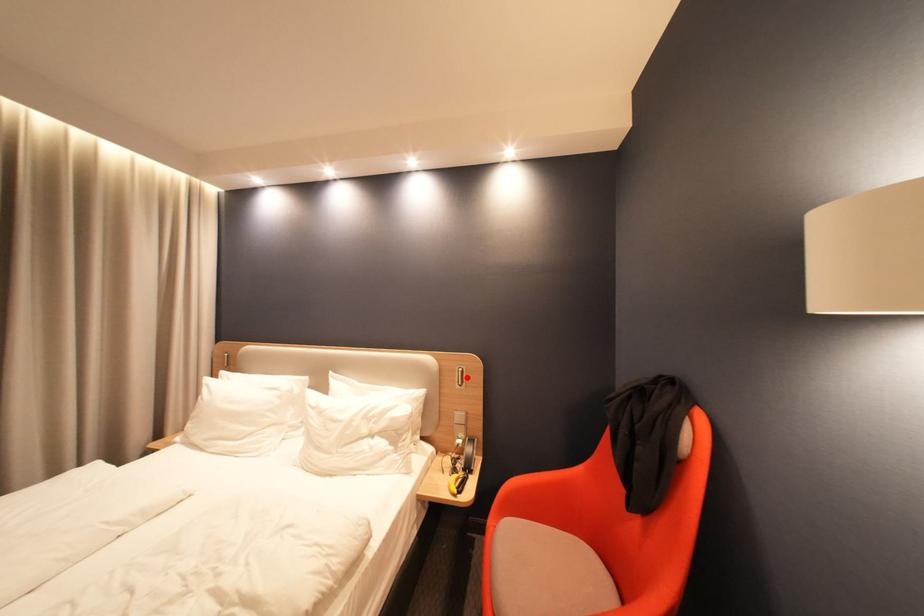
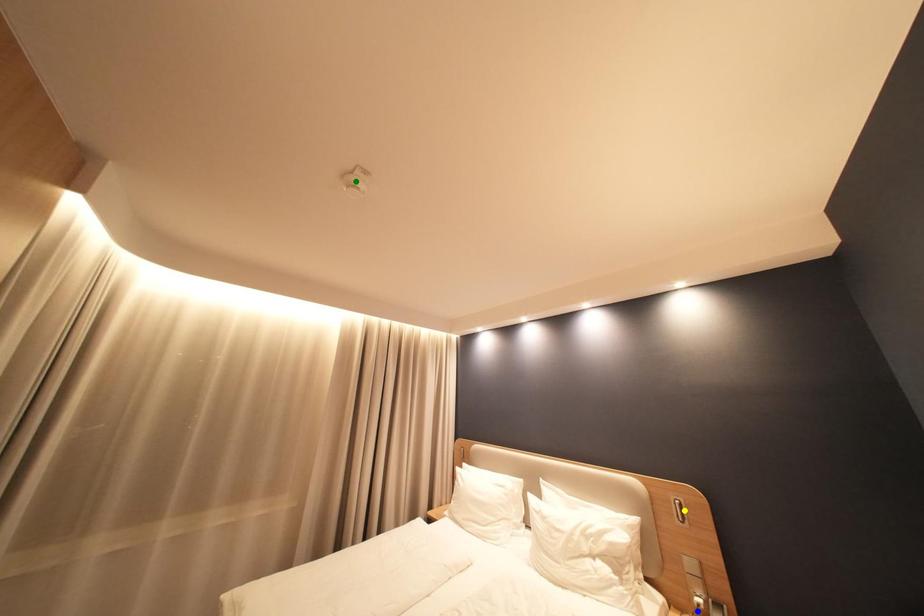
Question: I am providing you with two images of the same scene from different viewpoints. A red point is marked on the first image. You are given multiple points on the second image. Which point in image 2 represents the same 3d spot as the red point in image 1?

Choices:
 (A) blue point
 (B) green point
 (C) yellow point

Answer: (C)